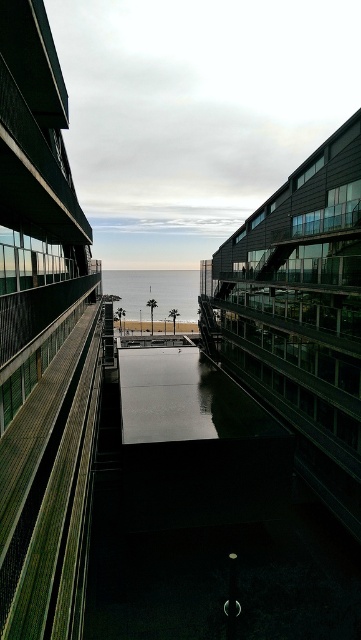
Can you confirm if black glass waterway at center is wider than blue glossy water at center?

No, black glass waterway at center is not wider than blue glossy water at center.

Can you confirm if black glass waterway at center is thinner than blue glossy water at center?

Yes.

The width and height of the screenshot is (361, 640). In order to click on black glass waterway at center in this screenshot , I will do `click(184, 400)`.

Locate an element on the screen. This screenshot has height=640, width=361. black glass waterway at center is located at coordinates (184, 400).